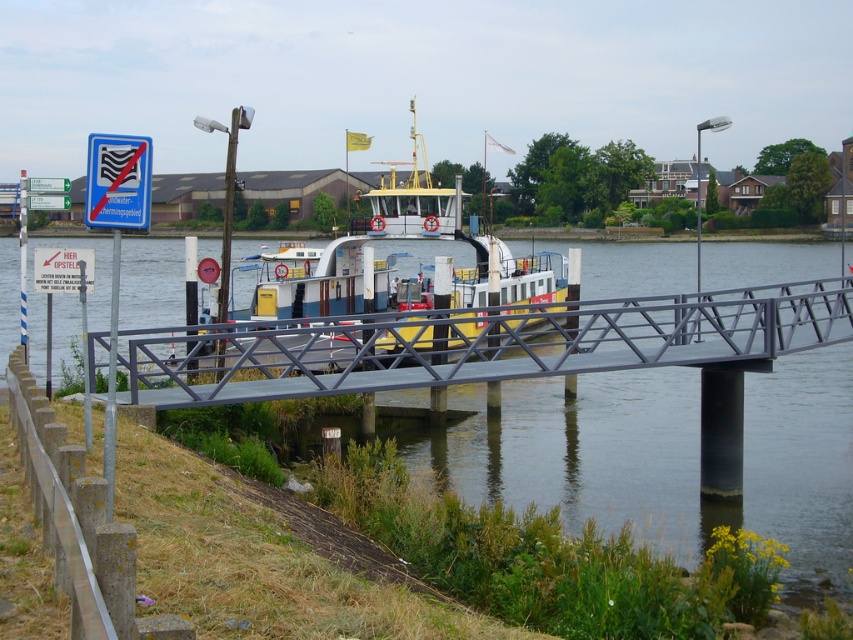
Can you confirm if metallic gray bridge at lower center is positioned below yellow painted metal ferry at center?

Correct, metallic gray bridge at lower center is located below yellow painted metal ferry at center.

Based on the photo, measure the distance from metallic gray bridge at lower center to yellow painted metal ferry at center.

The distance of metallic gray bridge at lower center from yellow painted metal ferry at center is 13.70 meters.

The image size is (853, 640). What do you see at coordinates (483, 344) in the screenshot?
I see `metallic gray bridge at lower center` at bounding box center [483, 344].

Where is `metallic gray bridge at lower center`? metallic gray bridge at lower center is located at coordinates (483, 344).